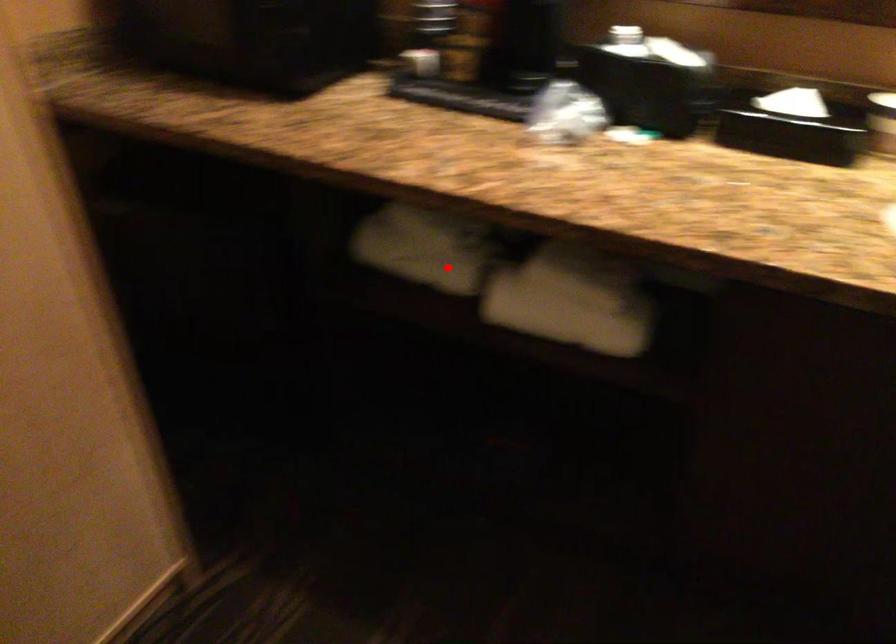
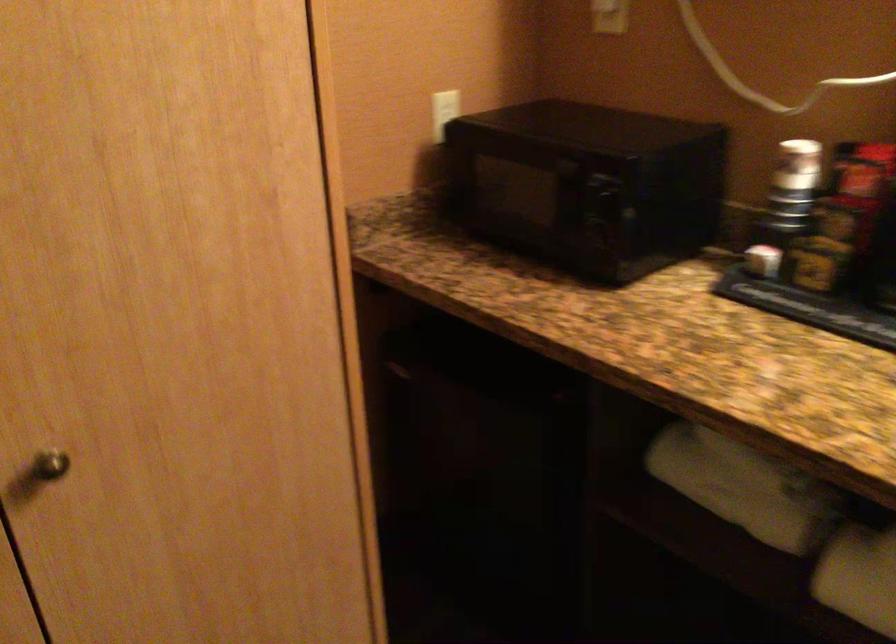
Question: I am providing you with two images of the same scene from different viewpoints. A red point is shown in image1. For the corresponding object point in image2, is it positioned nearer or farther from the camera?

Choices:
 (A) Nearer
 (B) Farther

Answer: (A)